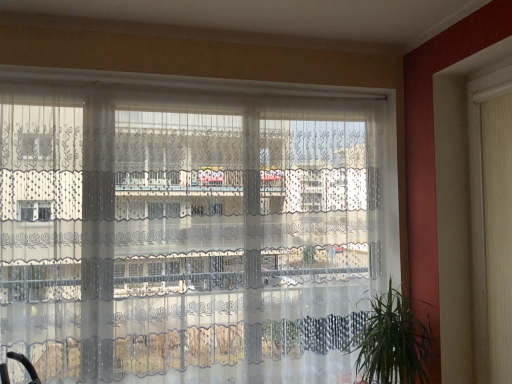
In order to face white fabric shutter at right, should I rotate leftwards or rightwards?

Rotate your view right by about 29.412°.

What do you see at coordinates (189, 230) in the screenshot? The width and height of the screenshot is (512, 384). I see `transparent lace curtains at center` at bounding box center [189, 230].

I want to click on white fabric shutter at right, so click(497, 227).

Which is in front, point (161, 297) or point (406, 348)?

The point (406, 348) is more forward.

Based on the photo, between transparent lace curtains at center and green leafy plant at lower right, which one has larger size?

transparent lace curtains at center.

Is transparent lace curtains at center facing away from green leafy plant at lower right?

Correct, transparent lace curtains at center is looking away from green leafy plant at lower right.

From the image's perspective, between transparent lace curtains at center and green leafy plant at lower right, which one is located above?

transparent lace curtains at center is shown above in the image.

Is white fabric shutter at right behind green leafy plant at lower right?

No, white fabric shutter at right is closer to the camera.

Find the location of a particular element. houseplant behind the white fabric shutter at right is located at coordinates (392, 342).

Consider the image. Is white fabric shutter at right wider than green leafy plant at lower right?

Incorrect, the width of white fabric shutter at right does not surpass that of green leafy plant at lower right.

Between point (511, 93) and point (393, 363), which one is positioned in front?

The point (511, 93) is closer to the camera.

In the scene shown: Measure the distance from transparent lace curtains at center to white fabric shutter at right.

The distance of transparent lace curtains at center from white fabric shutter at right is 1.35 meters.

From the image's perspective, would you say transparent lace curtains at center is positioned over white fabric shutter at right?

No.

Who is more distant, transparent lace curtains at center or white fabric shutter at right?

transparent lace curtains at center is behind.

How different are the orientations of white fabric shutter at right and transparent lace curtains at center in degrees?

93.1 degrees separate the facing orientations of white fabric shutter at right and transparent lace curtains at center.

Is point (509, 285) positioned in front of point (147, 106)?

Yes, point (509, 285) is in front of point (147, 106).

Considering the relative sizes of white fabric shutter at right and transparent lace curtains at center in the image provided, is white fabric shutter at right thinner than transparent lace curtains at center?

Yes, white fabric shutter at right is thinner than transparent lace curtains at center.

Consider the image. Can you confirm if white fabric shutter at right is smaller than transparent lace curtains at center?

Correct, white fabric shutter at right occupies less space than transparent lace curtains at center.

Considering the relative sizes of green leafy plant at lower right and transparent lace curtains at center in the image provided, is green leafy plant at lower right bigger than transparent lace curtains at center?

No, green leafy plant at lower right is not bigger than transparent lace curtains at center.

Is there a large distance between green leafy plant at lower right and transparent lace curtains at center?

No, green leafy plant at lower right is not far from transparent lace curtains at center.

Can you tell me how much green leafy plant at lower right and transparent lace curtains at center differ in facing direction?

There is a 3.06-degree angle between the facing directions of green leafy plant at lower right and transparent lace curtains at center.

Is green leafy plant at lower right positioned with its back to transparent lace curtains at center?

Yes, green leafy plant at lower right is facing away from transparent lace curtains at center.

Is green leafy plant at lower right positioned beyond the bounds of white fabric shutter at right?

Yes, green leafy plant at lower right is located beyond the bounds of white fabric shutter at right.

Is there a large distance between green leafy plant at lower right and white fabric shutter at right?

No, green leafy plant at lower right is not far away from white fabric shutter at right.

Measure the distance from green leafy plant at lower right to white fabric shutter at right.

21.31 inches.

Is green leafy plant at lower right to the left of white fabric shutter at right from the viewer's perspective?

Correct, you'll find green leafy plant at lower right to the left of white fabric shutter at right.

At what (x,y) coordinates should I click in order to perform the action: click on houseplant that appears on the right of transparent lace curtains at center. Please return your answer as a coordinate pair (x, y). The height and width of the screenshot is (384, 512). Looking at the image, I should click on (392, 342).

Find the location of a particular element. This screenshot has height=384, width=512. shutter positioned vertically above the green leafy plant at lower right (from a real-world perspective) is located at coordinates 497,227.

When comparing their distances from green leafy plant at lower right, does transparent lace curtains at center or white fabric shutter at right seem further?

The object further to green leafy plant at lower right is transparent lace curtains at center.

Based on their spatial positions, is transparent lace curtains at center or green leafy plant at lower right closer to white fabric shutter at right?

green leafy plant at lower right is closer to white fabric shutter at right.

Estimate the real-world distances between objects in this image. Which object is further from transparent lace curtains at center, green leafy plant at lower right or white fabric shutter at right?

The object further to transparent lace curtains at center is white fabric shutter at right.

Which object lies nearer to the anchor point transparent lace curtains at center, white fabric shutter at right or green leafy plant at lower right?

Among the two, green leafy plant at lower right is located nearer to transparent lace curtains at center.

Estimate the real-world distances between objects in this image. Which object is further from white fabric shutter at right, green leafy plant at lower right or transparent lace curtains at center?

transparent lace curtains at center is positioned further to the anchor white fabric shutter at right.

Based on the photo, based on their spatial positions, is white fabric shutter at right or transparent lace curtains at center closer to green leafy plant at lower right?

white fabric shutter at right lies closer to green leafy plant at lower right than the other object.

This screenshot has width=512, height=384. What are the coordinates of `houseplant located between transparent lace curtains at center and white fabric shutter at right in the left-right direction` in the screenshot? It's located at (392, 342).